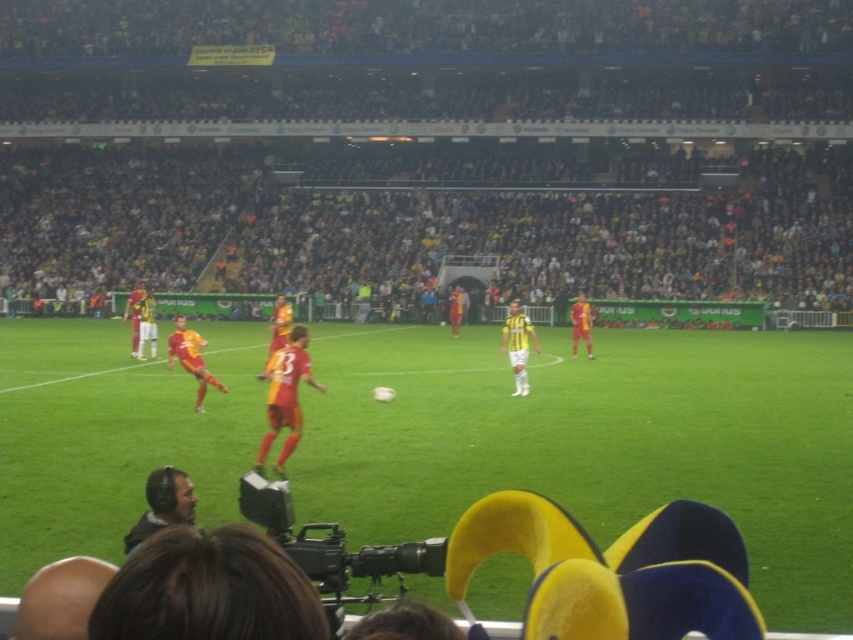
You are a soccer player positioned at the edge of the field. You need to pass the ball to your teammate wearing the matte orange jersey at center. Based on the scene, in which direction should you aim the pass relative to the green grass football field at center?

The matte orange jersey at center is positioned on the left side of the green grass football field at center. Therefore, you should aim your pass to the left side of the green grass football field at center to reach your teammate.

You are a spectator at the soccer match and want to take a photo of the orange jersey at center without the matte black headphones at lower left appearing in the frame. Is this possible?

The matte black headphones at lower left is positioned under orange jersey at center, so if you position yourself to focus on the orange jersey at center, the matte black headphones at lower left might still be visible below it. Adjust your angle to avoid capturing the lower left area where the headphones are located.